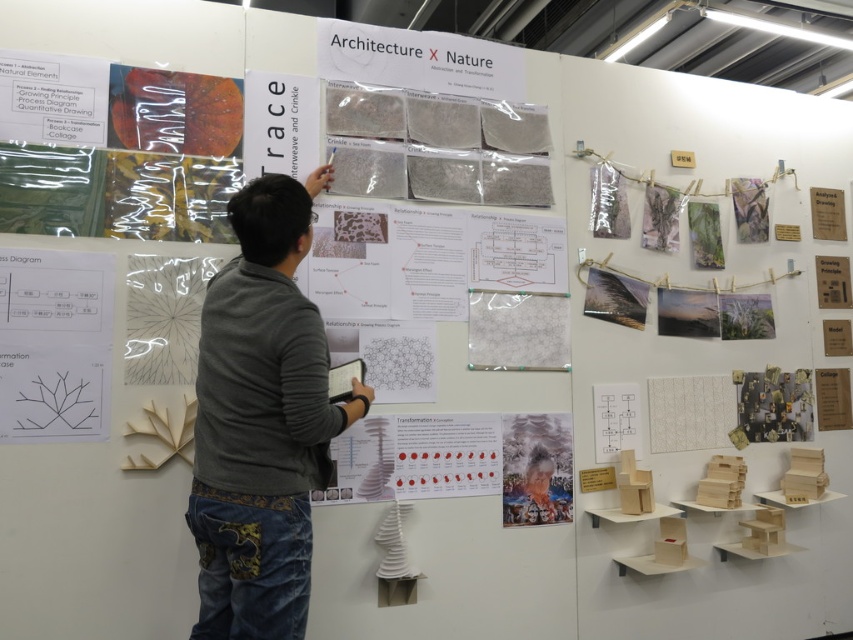
Consider the image. Does white felt at center appear on the left side of matte paper portrait at center?

Correct, you'll find white felt at center to the left of matte paper portrait at center.

Who is more forward, (556, 317) or (531, 492)?

Point (531, 492) is in front.

Which is behind, point (514, 353) or point (544, 515)?

Point (544, 515)

The image size is (853, 640). Identify the location of white felt at center. (517, 332).

Between black line diagram at lower left and matte paper portrait at center, which one is positioned lower?

Positioned lower is matte paper portrait at center.

Who is more distant from viewer, (68, 369) or (503, 483)?

The point (503, 483) is more distant.

Where is `black line diagram at lower left`? The width and height of the screenshot is (853, 640). black line diagram at lower left is located at coordinates (54, 344).

Between black line diagram at lower left and white felt at center, which one appears on the right side from the viewer's perspective?

white felt at center

Which is behind, point (103, 348) or point (569, 344)?

Positioned behind is point (569, 344).

Identify the location of black line diagram at lower left. (54, 344).